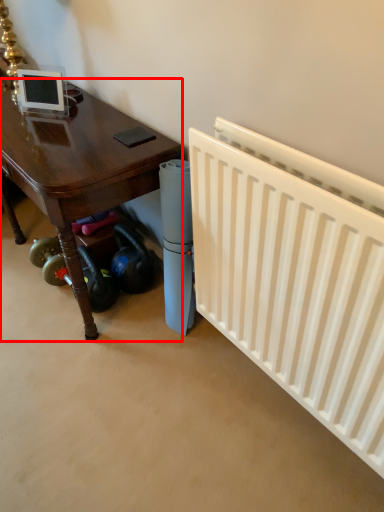
Question: From the image's perspective, what is the correct spatial positioning of table (annotated by the red box) in reference to radiator?

Choices:
 (A) above
 (B) below

Answer: (A)